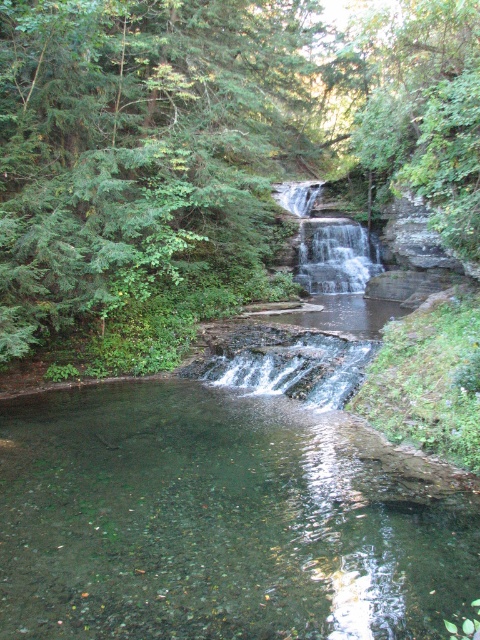
Does clear glass stream at center appear under clear water at center?

Indeed, clear glass stream at center is positioned under clear water at center.

Is point (404, 628) closer to camera compared to point (313, 252)?

Yes, point (404, 628) is closer to viewer.

I want to click on clear glass stream at center, so click(x=216, y=522).

Who is higher up, green leafy tree at center or clear glass stream at center?

green leafy tree at center is above.

Is point (181, 276) positioned in front of point (280, 432)?

No, (181, 276) is behind (280, 432).

Where is `green leafy tree at center`? green leafy tree at center is located at coordinates (208, 154).

Does green leafy tree at center appear on the left side of clear water at center?

Yes, green leafy tree at center is to the left of clear water at center.

Who is more distant from viewer, (219,68) or (376,268)?

Positioned behind is point (376,268).

Image resolution: width=480 pixels, height=640 pixels. In order to click on green leafy tree at center in this screenshot , I will do `click(208, 154)`.

You are a GUI agent. You are given a task and a screenshot of the screen. Output one action in this format:
    pyautogui.click(x=<x>, y=<y>)
    Task: Click on the green leafy tree at center
    This screenshot has height=640, width=480.
    Given the screenshot: What is the action you would take?
    pyautogui.click(x=208, y=154)